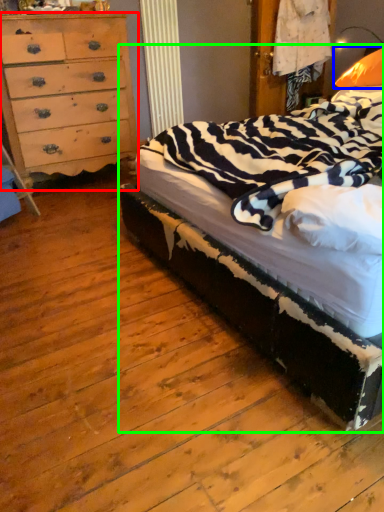
Question: Estimate the real-world distances between objects in this image. Which object is farther from chest of drawers (highlighted by a red box), pillow (highlighted by a blue box) or bed (highlighted by a green box)?

Choices:
 (A) pillow
 (B) bed

Answer: (A)